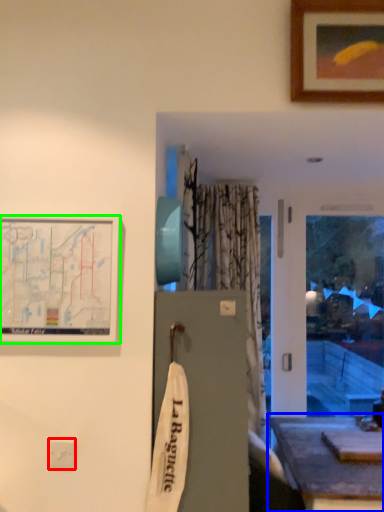
Question: Which is nearer to the electric outlet (highlighted by a red box)? table (highlighted by a blue box) or picture frame (highlighted by a green box).

Choices:
 (A) table
 (B) picture frame

Answer: (B)